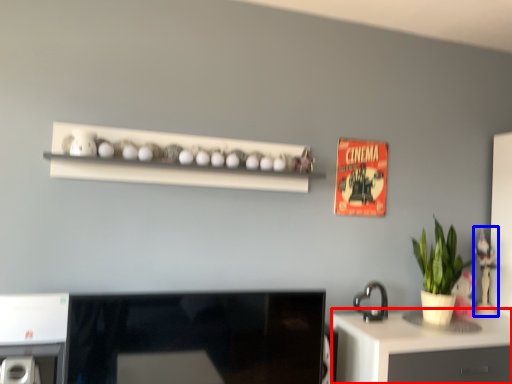
Question: Which object appears farthest to the camera in this image, desk (highlighted by a red box) or toy (highlighted by a blue box)?

Choices:
 (A) desk
 (B) toy

Answer: (B)